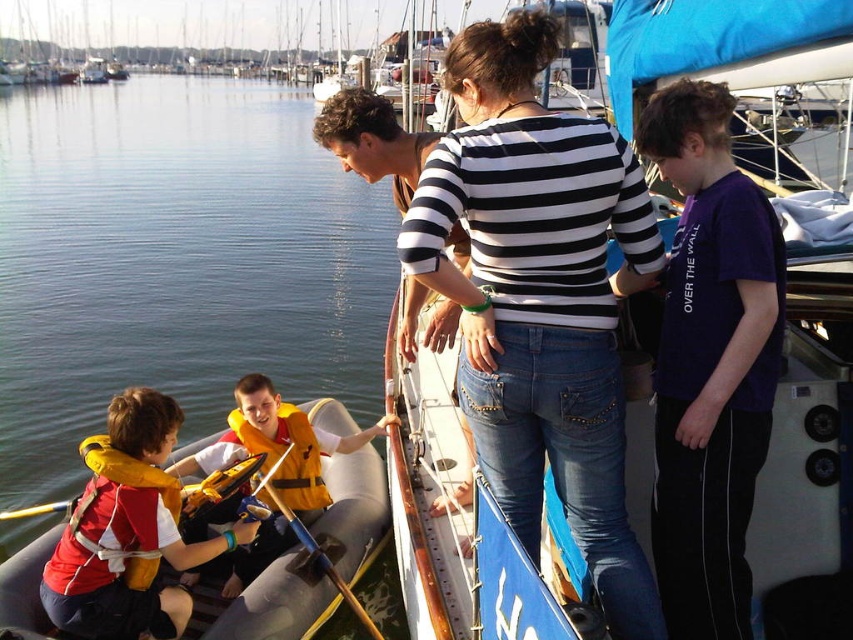
You are a lifeguard at the marina and need to quickly identify the child who is taller. Which child is taller between the black and white striped shirt at center and the yellow life vest at left?

The black and white striped shirt at center is taller than the yellow life vest at left.

Based on the photo, you are a safety inspector checking the positioning of life vests on the inflatable boat. According to the image, is the black and white striped shirt at center positioned above the yellow life vest at left?

Yes, the black and white striped shirt at center is located above the yellow life vest at left according to the description.